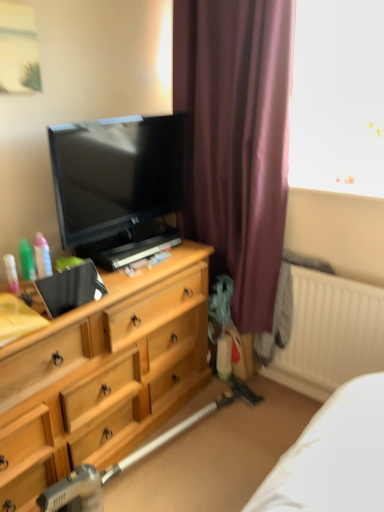
Question: Is matte black tv at left looking in the opposite direction of metallic silver vacuum cleaner at lower center?

Choices:
 (A) yes
 (B) no

Answer: (B)

Question: Considering the relative sizes of matte black tv at left and metallic silver vacuum cleaner at lower center in the image provided, is matte black tv at left taller than metallic silver vacuum cleaner at lower center?

Choices:
 (A) yes
 (B) no

Answer: (A)

Question: Can you confirm if matte black tv at left is shorter than metallic silver vacuum cleaner at lower center?

Choices:
 (A) no
 (B) yes

Answer: (A)

Question: From a real-world perspective, does matte black tv at left sit lower than metallic silver vacuum cleaner at lower center?

Choices:
 (A) yes
 (B) no

Answer: (B)

Question: Does matte black tv at left have a lesser width compared to metallic silver vacuum cleaner at lower center?

Choices:
 (A) yes
 (B) no

Answer: (A)

Question: Considering the relative sizes of matte black tv at left and metallic silver vacuum cleaner at lower center in the image provided, is matte black tv at left wider than metallic silver vacuum cleaner at lower center?

Choices:
 (A) yes
 (B) no

Answer: (B)

Question: Does matte black tv at left come behind white ribbed radiator at right?

Choices:
 (A) no
 (B) yes

Answer: (A)

Question: Considering the relative positions of matte black tv at left and white ribbed radiator at right in the image provided, is matte black tv at left in front of white ribbed radiator at right?

Choices:
 (A) yes
 (B) no

Answer: (A)

Question: Does matte black tv at left have a larger size compared to white ribbed radiator at right?

Choices:
 (A) yes
 (B) no

Answer: (B)

Question: Does matte black tv at left have a smaller size compared to white ribbed radiator at right?

Choices:
 (A) yes
 (B) no

Answer: (A)

Question: Can you see matte black tv at left touching white ribbed radiator at right?

Choices:
 (A) no
 (B) yes

Answer: (A)

Question: From a real-world perspective, is matte black tv at left located beneath white ribbed radiator at right?

Choices:
 (A) no
 (B) yes

Answer: (A)